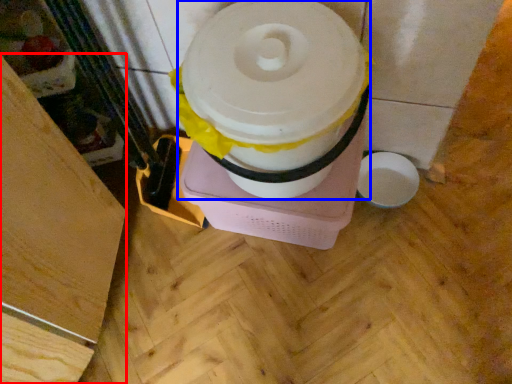
Question: Which point is closer to the camera, wood (highlighted by a red box) or toilet paper (highlighted by a blue box)?

Choices:
 (A) wood
 (B) toilet paper

Answer: (A)